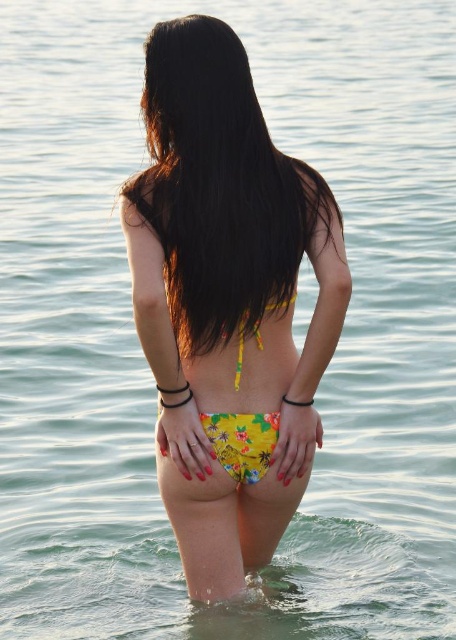
You are a photographer taking a picture of the person in the image. You want to ensure that the yellow floral bikini bottom at center is visible in the shot. Since the yellow floral fabric bikini top at center might cover it, where should you position the camera relative to the person?

The yellow floral bikini bottom at center is above the yellow floral fabric bikini top at center, so positioning the camera slightly above the person will ensure the bikini bottom remains visible and not obscured by the top.

You are a photographer trying to capture the perfect shot of the person in the image. You want to ensure the yellow floral bikini bottom at center and the yellow floral fabric bikini top at center are both clearly visible in the frame. Based on their positions, which one should you focus on first to ensure both are in focus?

The yellow floral bikini bottom at center is positioned on the left side of the yellow floral fabric bikini top at center. To ensure both are in focus, you should focus on the yellow floral fabric bikini top at center first since it is closer to the center of the image, making it easier to frame both elements together.